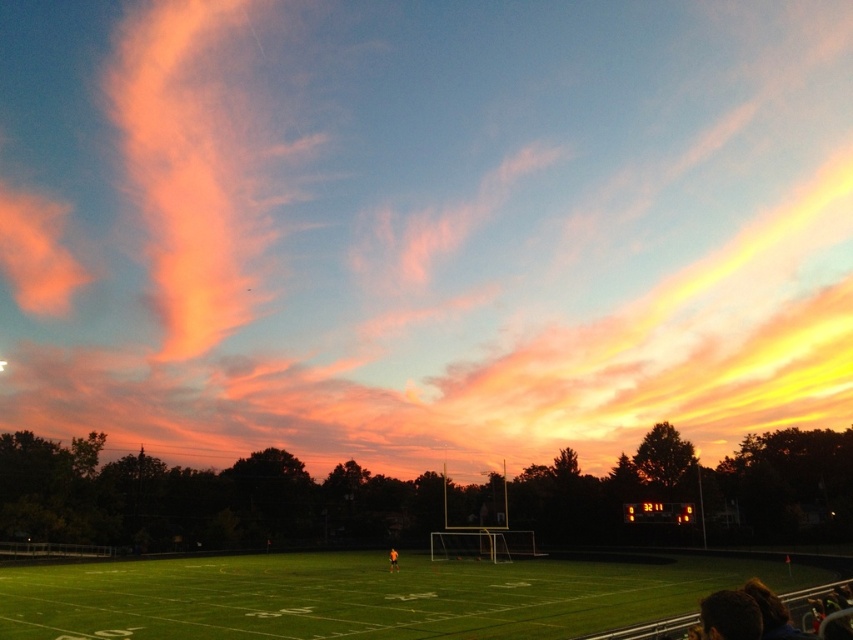
Question: Which of the following is the farthest from the observer?

Choices:
 (A) (397, 557)
 (B) (218, 192)
 (C) (415, 612)

Answer: (B)

Question: From the image, what is the correct spatial relationship of green artificial turf at center in relation to orange fabric person at center?

Choices:
 (A) below
 (B) above

Answer: (B)

Question: Considering the relative positions of pink cotton candy cloud at upper center and green artificial turf at center in the image provided, where is pink cotton candy cloud at upper center located with respect to green artificial turf at center?

Choices:
 (A) below
 (B) above

Answer: (B)

Question: Can you confirm if green artificial turf at center is positioned to the right of orange fabric person at center?

Choices:
 (A) yes
 (B) no

Answer: (B)

Question: Which point appears closest to the camera in this image?

Choices:
 (A) (657, 595)
 (B) (566, 122)
 (C) (393, 570)

Answer: (A)

Question: Which object appears closest to the camera in this image?

Choices:
 (A) green artificial turf at center
 (B) orange fabric person at center

Answer: (A)